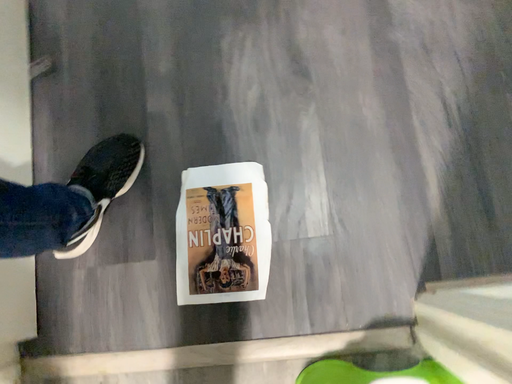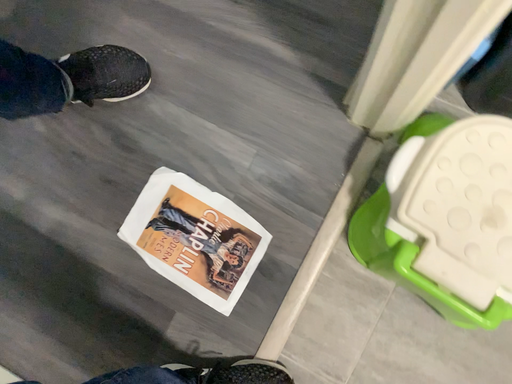
Question: Which way did the camera rotate in the video?

Choices:
 (A) rotated upward
 (B) rotated downward

Answer: (A)